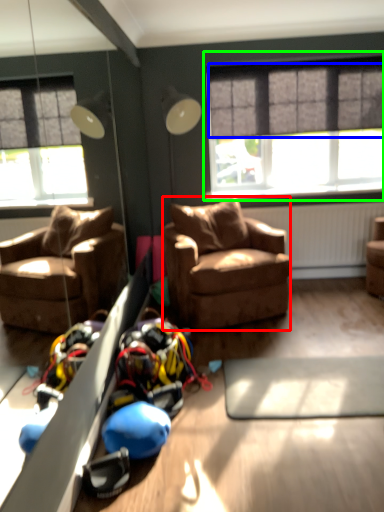
Question: Which is nearer to the studio couch (highlighted by a red box)? curtain (highlighted by a blue box) or window (highlighted by a green box).

Choices:
 (A) curtain
 (B) window

Answer: (B)